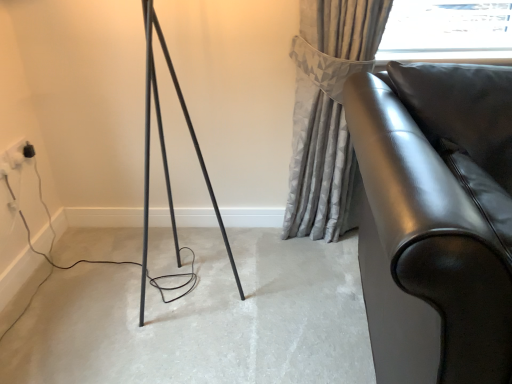
Question: Visually, is black plastic outlet at lower left positioned to the left or to the right of glossy leather sofa at right?

Choices:
 (A) left
 (B) right

Answer: (A)

Question: In terms of size, does black plastic outlet at lower left appear bigger or smaller than glossy leather sofa at right?

Choices:
 (A) big
 (B) small

Answer: (B)

Question: Which object is positioned farthest from the black plastic outlet at lower left?

Choices:
 (A) gray textured curtain at upper right
 (B) glossy leather sofa at right
 (C) matte black floor at center

Answer: (B)

Question: Estimate the real-world distances between objects in this image. Which object is farther from the gray textured curtain at upper right?

Choices:
 (A) glossy leather sofa at right
 (B) black plastic outlet at lower left
 (C) matte black floor at center

Answer: (B)